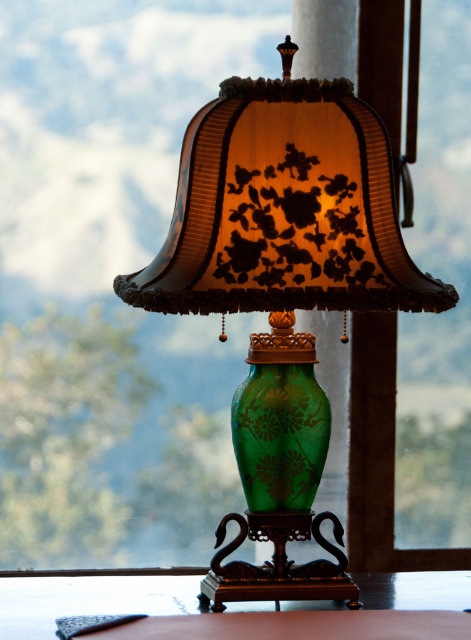
Based on the photo, you are an interior designer assessing the placement of the green glass vase at center and the green glass table at center in the scene. Based on their sizes, which object would you recommend placing in a location where height is a concern?

The green glass table at center is shorter than the green glass vase at center, so placing the green glass table at center in the location with height constraints would be more appropriate.

You are arranging flowers for a special event and need to place a bouquet in the green glass vase at center. However, you notice the green glass table at center nearby. Can you place the vase on the table without it falling off?

The green glass vase at center is located above the green glass table at center, so it is already placed on the table. Therefore, you can safely place the bouquet in the vase without it falling off.

You are standing in front of the vintage table lamp. There are two points marked on the lamp, one at coordinates point (349, 125) and another at point (124, 609). Which point is closer to you?

Point (349, 125) is closer to the viewer than point (124, 609).